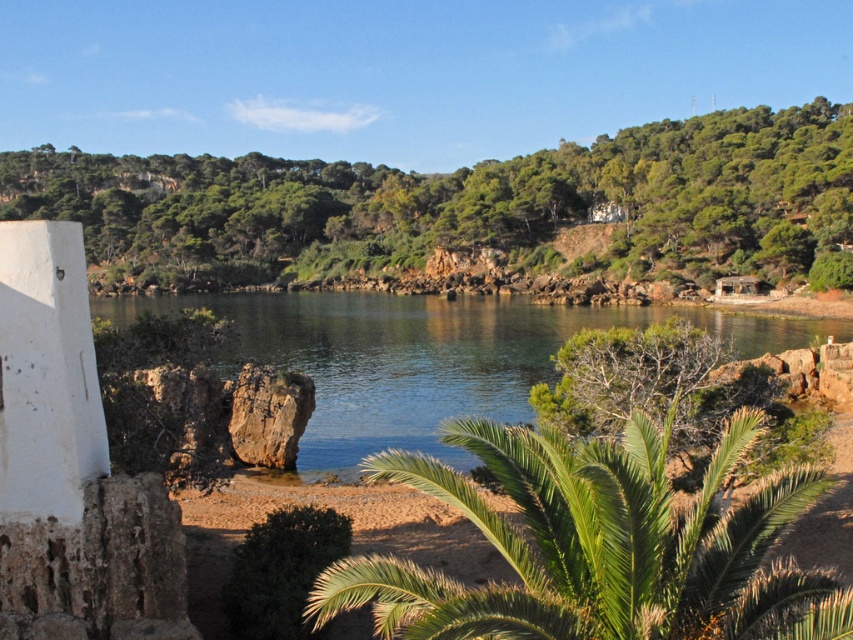
Is green leafy palm tree at center shorter than clear water at center?

Indeed, green leafy palm tree at center has a lesser height compared to clear water at center.

From the picture: Who is more forward, (521, 484) or (537, 339)?

Point (521, 484)

In order to click on green leafy palm tree at center in this screenshot , I will do `click(599, 545)`.